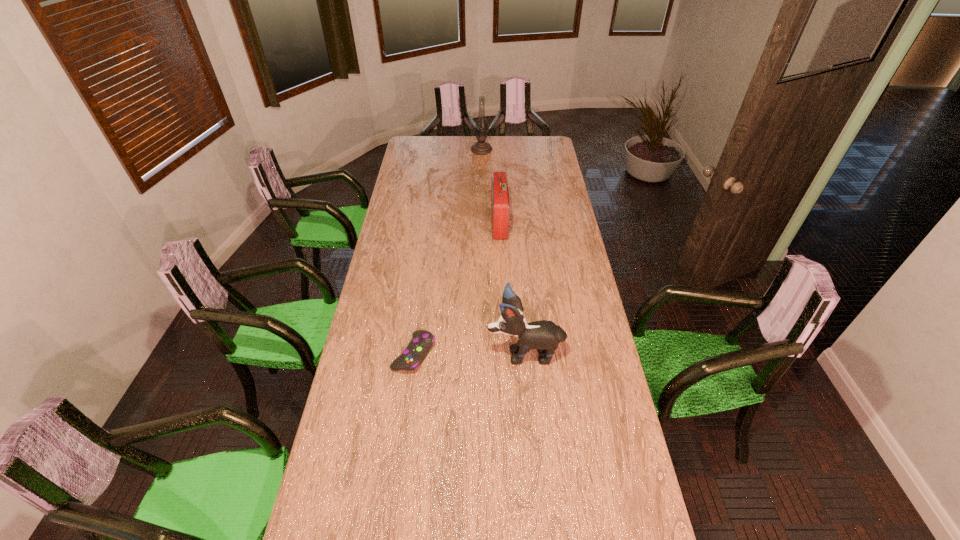
This screenshot has width=960, height=540. Identify the location of object that stands as the third closest to the puppy. (481, 147).

Locate an element on the screen. Image resolution: width=960 pixels, height=540 pixels. free location that satisfies the following two spatial constraints: 1. on the front-facing side of the puppy; 2. on the front side of the control is located at coordinates (525, 354).